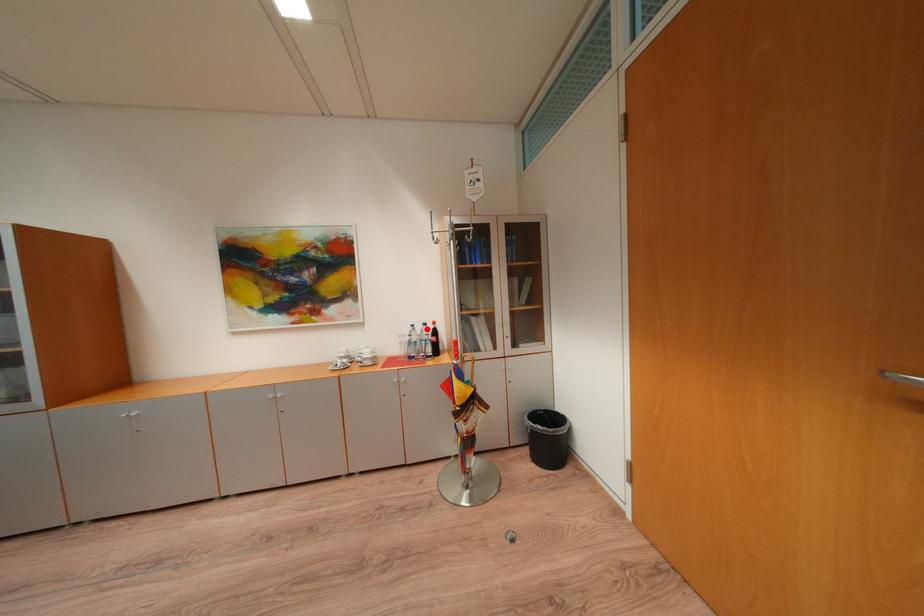
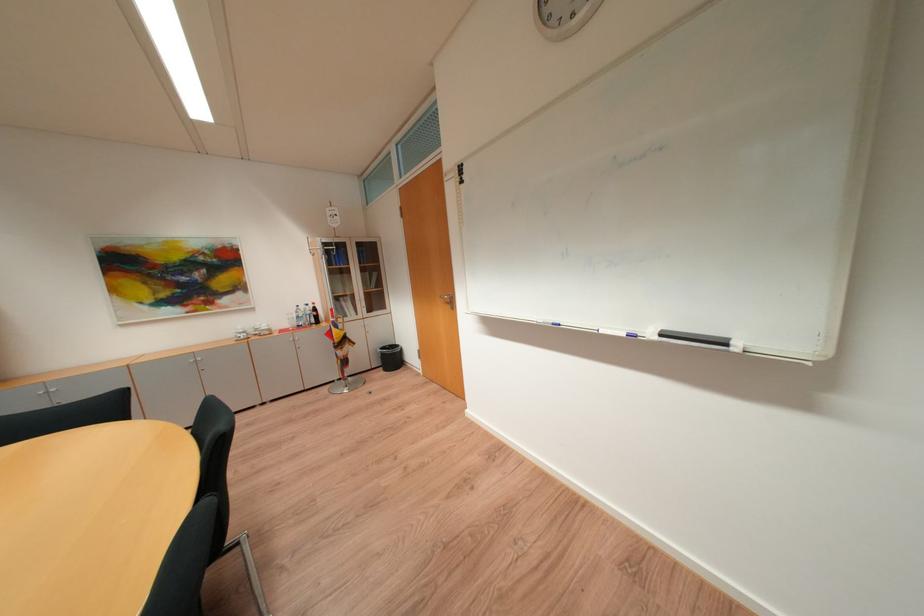
Question: I am providing you with two images of the same scene from different viewpoints. In image1, a red point is highlighted. Considering the same 3D point in image2, which of the following is correct?

Choices:
 (A) It is closer
 (B) It is farther

Answer: (A)